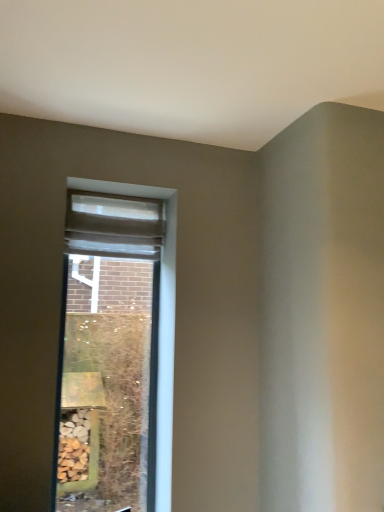
What is the approximate width of matte beige curtain at upper center?

It is 4.90 inches.

Locate an element on the screen. The image size is (384, 512). matte beige curtain at upper center is located at coordinates (113, 225).

What do you see at coordinates (113, 225) in the screenshot?
I see `matte beige curtain at upper center` at bounding box center [113, 225].

Where is `matte beige curtain at upper center`? This screenshot has height=512, width=384. matte beige curtain at upper center is located at coordinates (113, 225).